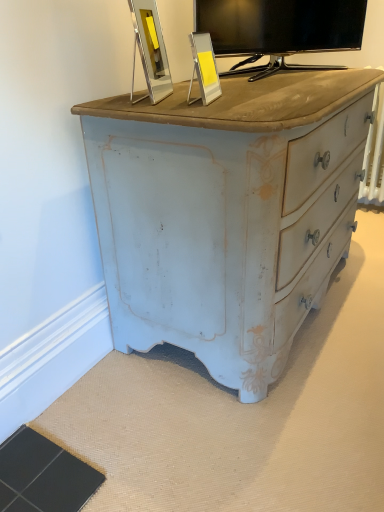
Question: Does metallic silver picture frame at upper center, acting as the 2th picture frame starting from the left, contain matte black tv at upper center?

Choices:
 (A) no
 (B) yes

Answer: (A)

Question: Considering the relative sizes of metallic silver picture frame at upper center, which is the 1th picture frame from right to left, and matte black tv at upper center in the image provided, is metallic silver picture frame at upper center, which is the 1th picture frame from right to left, bigger than matte black tv at upper center?

Choices:
 (A) no
 (B) yes

Answer: (A)

Question: Is metallic silver picture frame at upper center, which is the 1th picture frame from right to left, smaller than matte black tv at upper center?

Choices:
 (A) yes
 (B) no

Answer: (A)

Question: Considering the relative positions of metallic silver picture frame at upper center, which is the 1th picture frame from right to left, and matte black tv at upper center in the image provided, is metallic silver picture frame at upper center, which is the 1th picture frame from right to left, to the right of matte black tv at upper center from the viewer's perspective?

Choices:
 (A) yes
 (B) no

Answer: (B)

Question: Does metallic silver picture frame at upper center, which is the 1th picture frame from right to left, have a lesser height compared to matte black tv at upper center?

Choices:
 (A) yes
 (B) no

Answer: (A)

Question: Is metallic silver picture frame at upper center, which is the 1th picture frame from right to left, outside matte black tv at upper center?

Choices:
 (A) yes
 (B) no

Answer: (A)

Question: Is metallic silver picture frame at upper center, acting as the 2th picture frame starting from the left, wider than silver metallic picture frame at upper center, which is the first picture frame from left to right?

Choices:
 (A) yes
 (B) no

Answer: (B)

Question: From a real-world perspective, is metallic silver picture frame at upper center, acting as the 2th picture frame starting from the left, over silver metallic picture frame at upper center, which is the first picture frame from left to right?

Choices:
 (A) no
 (B) yes

Answer: (A)

Question: Is silver metallic picture frame at upper center, which is the first picture frame from left to right, a part of metallic silver picture frame at upper center, acting as the 2th picture frame starting from the left?

Choices:
 (A) yes
 (B) no

Answer: (B)

Question: Is metallic silver picture frame at upper center, acting as the 2th picture frame starting from the left, looking in the opposite direction of silver metallic picture frame at upper center, which is the first picture frame from left to right?

Choices:
 (A) no
 (B) yes

Answer: (B)

Question: From a real-world perspective, is metallic silver picture frame at upper center, which is the 1th picture frame from right to left, under silver metallic picture frame at upper center, which is the first picture frame from left to right?

Choices:
 (A) yes
 (B) no

Answer: (A)

Question: Does metallic silver picture frame at upper center, acting as the 2th picture frame starting from the left, lie in front of silver metallic picture frame at upper center, the 2th picture frame from the right?

Choices:
 (A) no
 (B) yes

Answer: (A)

Question: Does matte black tv at upper center have a smaller size compared to silver metallic picture frame at upper center, the 2th picture frame from the right?

Choices:
 (A) yes
 (B) no

Answer: (B)